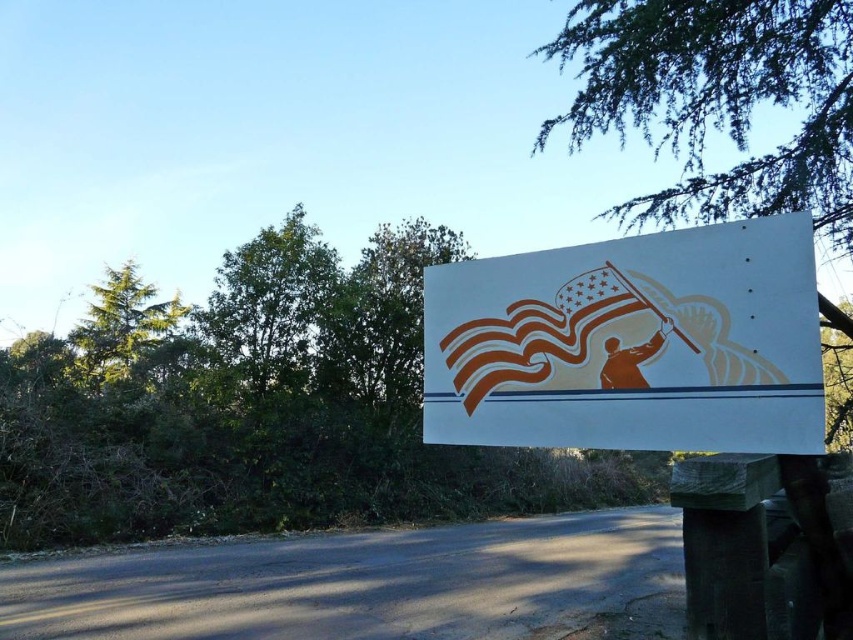
Is white matte sign at center closer to the viewer compared to green needle-like branches at upper right?

Yes, it is in front of green needle-like branches at upper right.

Is white matte sign at center above green needle-like branches at upper right?

Incorrect, white matte sign at center is not positioned above green needle-like branches at upper right.

Which is behind, point (791, 340) or point (645, 22)?

Point (645, 22)

Identify the location of white matte sign at center. This screenshot has width=853, height=640. (631, 342).

Between green needle-like branches at upper right and green leafy tree at upper left, which one has less height?

green needle-like branches at upper right

Where is `green needle-like branches at upper right`? Image resolution: width=853 pixels, height=640 pixels. green needle-like branches at upper right is located at coordinates (718, 100).

Measure the distance between green needle-like branches at upper right and camera.

A distance of 6.60 meters exists between green needle-like branches at upper right and camera.

Find the location of `green needle-like branches at upper right`. green needle-like branches at upper right is located at coordinates (718, 100).

Can you confirm if white matte sign at center is wider than green leafy tree at upper left?

In fact, white matte sign at center might be narrower than green leafy tree at upper left.

Where is `white matte sign at center`? This screenshot has width=853, height=640. white matte sign at center is located at coordinates (631, 342).